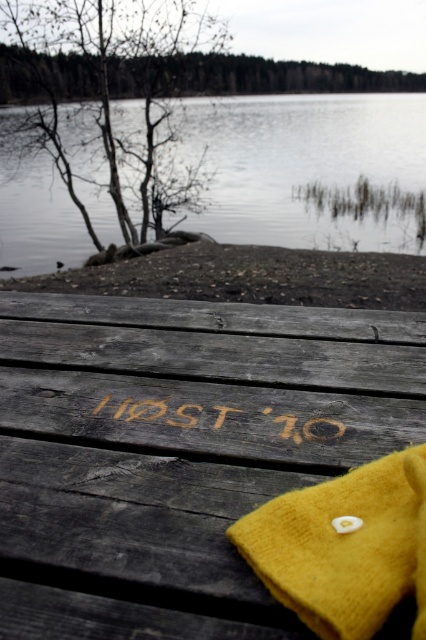
You are a GUI agent. You are given a task and a screenshot of the screen. Output one action in this format:
    pyautogui.click(x=<x>, y=<y>)
    Task: Click on the wooden picnic table at center
    This screenshot has height=640, width=426.
    Given the screenshot: What is the action you would take?
    pyautogui.click(x=178, y=451)

Is wooden picnic table at center to the right of carved wood host '10 at center from the viewer's perspective?

Indeed, wooden picnic table at center is positioned on the right side of carved wood host '10 at center.

You are a GUI agent. You are given a task and a screenshot of the screen. Output one action in this format:
    pyautogui.click(x=<x>, y=<y>)
    Task: Click on the wooden picnic table at center
    The height and width of the screenshot is (640, 426).
    Given the screenshot: What is the action you would take?
    pyautogui.click(x=178, y=451)

Looking at this image, does wooden plank at center appear on the right side of dark gray wood plank at center?

Yes, wooden plank at center is to the right of dark gray wood plank at center.

Does wooden plank at center appear over dark gray wood plank at center?

No, wooden plank at center is not above dark gray wood plank at center.

At what (x,y) coordinates should I click in order to perform the action: click on wooden plank at center. Please return your answer as a coordinate pair (x, y). The width and height of the screenshot is (426, 640). Looking at the image, I should click on (207, 417).

Can you confirm if wooden plank at center is taller than mustard felt hat at center?

Incorrect, wooden plank at center's height is not larger of mustard felt hat at center's.

Does wooden plank at center appear on the right side of mustard felt hat at center?

Incorrect, wooden plank at center is not on the right side of mustard felt hat at center.

Is point (273, 433) positioned before point (393, 506)?

No, (273, 433) is further to viewer.

At what (x,y) coordinates should I click in order to perform the action: click on wooden plank at center. Please return your answer as a coordinate pair (x, y). Image resolution: width=426 pixels, height=640 pixels. Looking at the image, I should click on (207, 417).